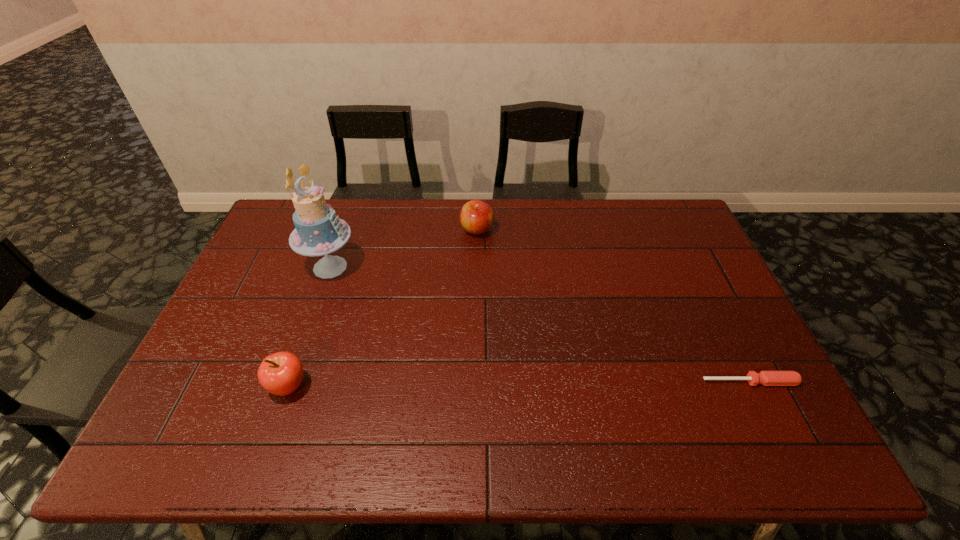
At what (x,y) coordinates should I click in order to perform the action: click on vacant spot on the desktop that is between the left apple and the rightmost object and is positioned with a ladder on the side of the cake. Please return your answer as a coordinate pair (x, y). This screenshot has width=960, height=540. Looking at the image, I should click on (489, 384).

Locate an element on the screen. free space on the desktop that is between the left apple and the rightmost object and is positioned on the stem of the farthest object is located at coordinates (483, 384).